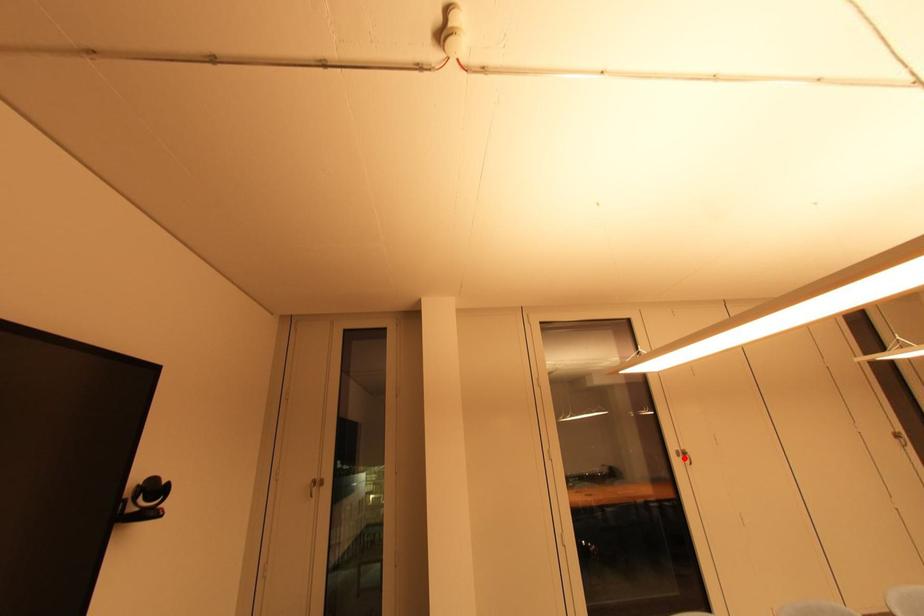
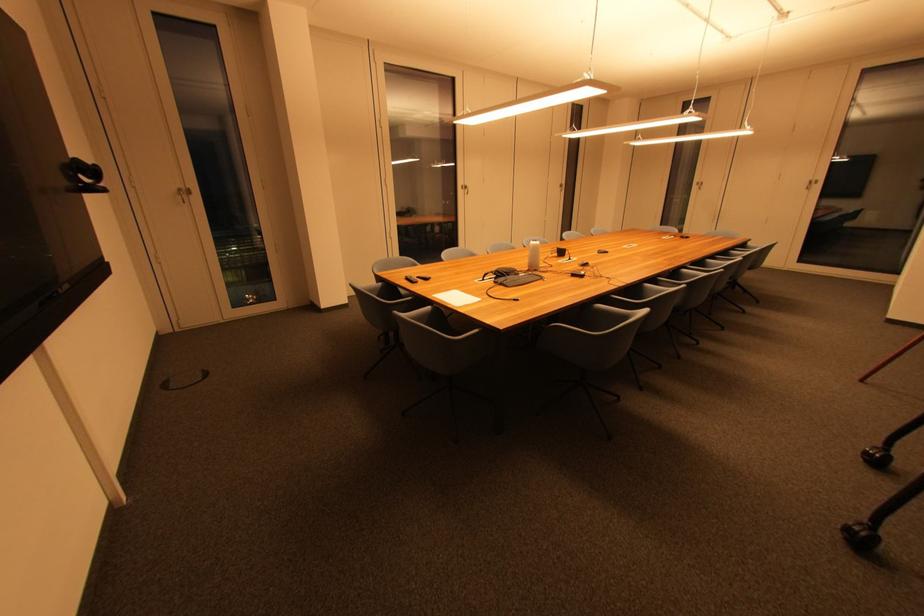
Where in the second image is the point corresponding to the highlighted location from the first image?

(468, 190)